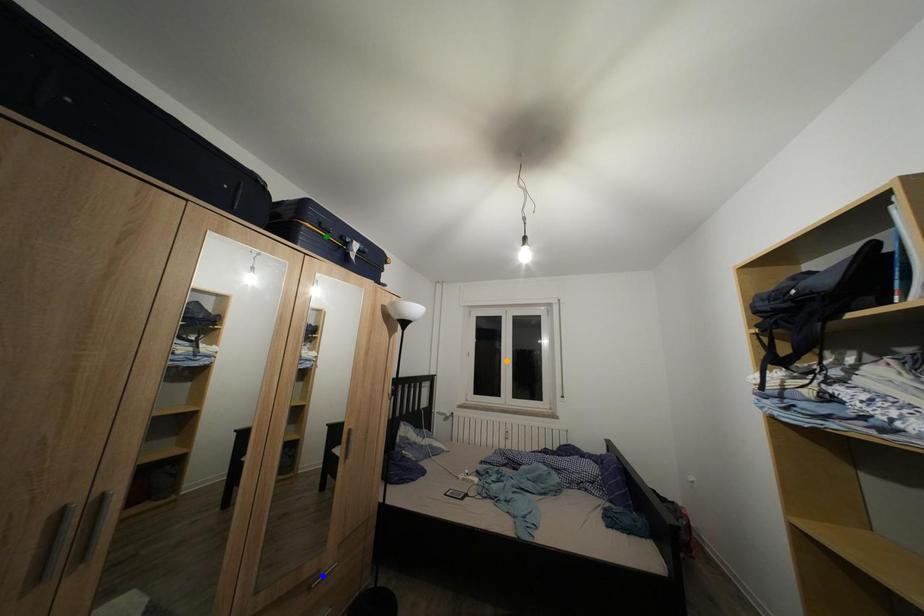
Order these from nearest to farthest:
- green point
- blue point
- orange point

blue point → green point → orange point